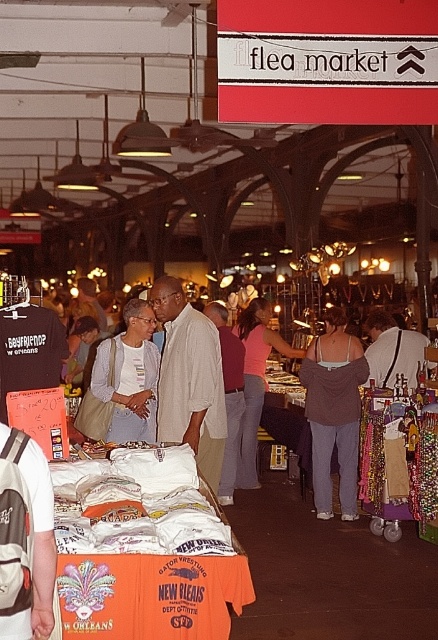
Does point (335, 307) come in front of point (258, 419)?

Yes, point (335, 307) is closer to viewer.

Is point (324, 353) behind point (251, 438)?

That is False.

Locate an element on the screen. The height and width of the screenshot is (640, 438). matte gray tank top at center is located at coordinates (334, 412).

Does beige cotton shirt at center have a lesser width compared to matte gray tank top at center?

Indeed, beige cotton shirt at center has a lesser width compared to matte gray tank top at center.

Who is higher up, beige cotton shirt at center or matte gray tank top at center?

beige cotton shirt at center is above.

Describe the element at coordinates (190, 380) in the screenshot. This screenshot has height=640, width=438. I see `beige cotton shirt at center` at that location.

Where is `beige cotton shirt at center`? This screenshot has width=438, height=640. beige cotton shirt at center is located at coordinates tap(190, 380).

What do you see at coordinates (190, 380) in the screenshot?
I see `beige cotton shirt at center` at bounding box center [190, 380].

Is beige cotton shirt at center shorter than light blue denim jacket at center?

In fact, beige cotton shirt at center may be taller than light blue denim jacket at center.

Is point (208, 340) positioned behind point (144, 403)?

No, it is in front of (144, 403).

Where is `beige cotton shirt at center`? beige cotton shirt at center is located at coordinates (190, 380).